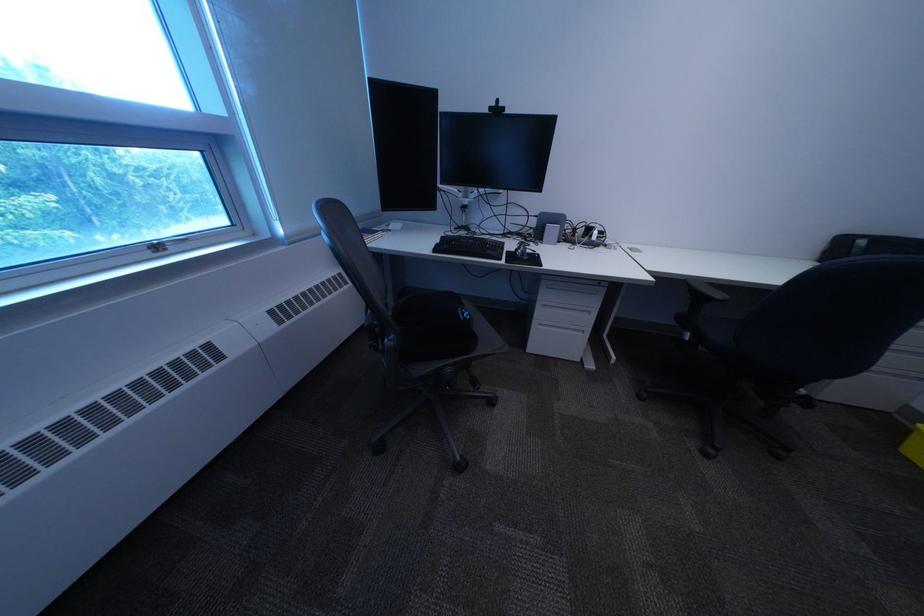
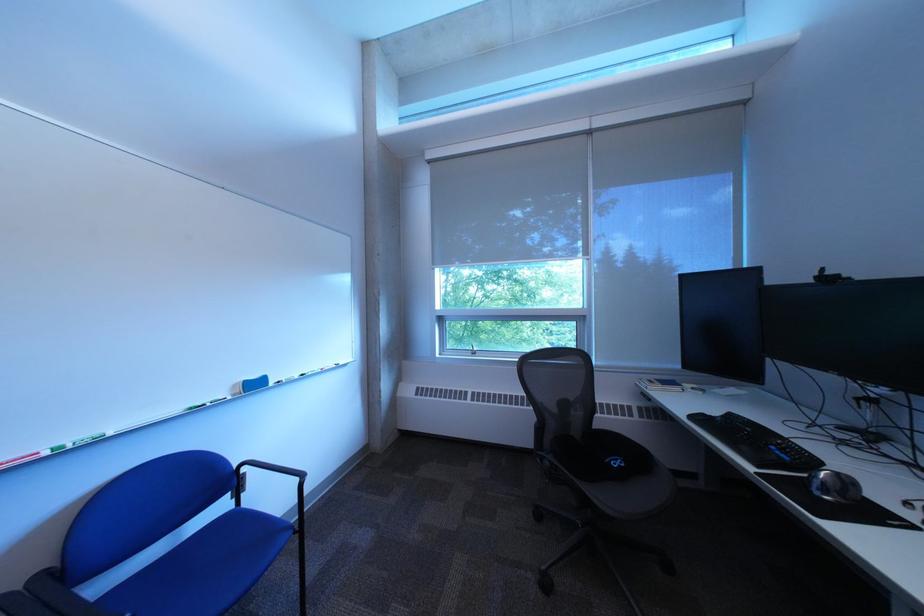
Where in the second image is the point corresponding to point 451,252 from the first image?

(708, 419)